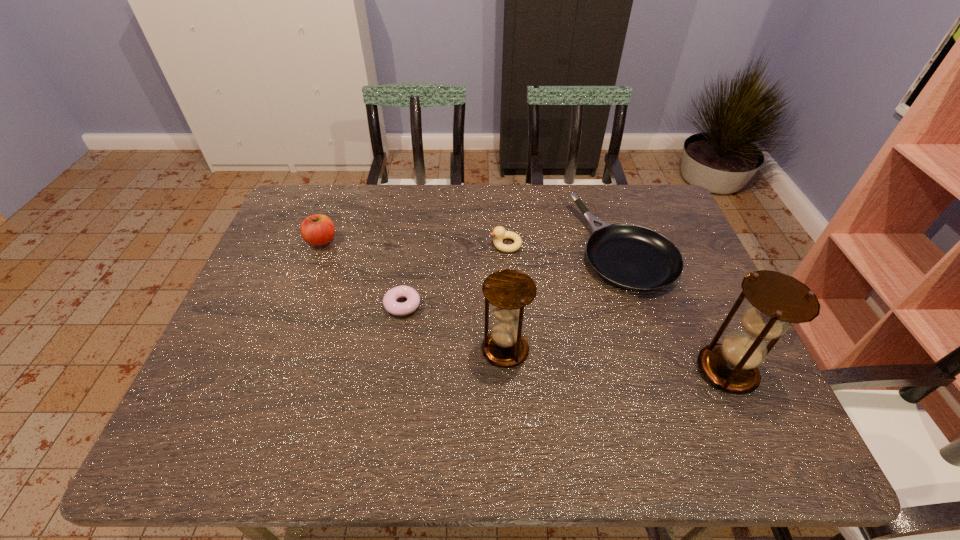
At what (x,y) coordinates should I click in order to perform the action: click on object that is at the left edge. Please return your answer as a coordinate pair (x, y). This screenshot has width=960, height=540. Looking at the image, I should click on (317, 230).

This screenshot has height=540, width=960. What are the coordinates of `hourglass that is at the right edge` in the screenshot? It's located at (777, 300).

The height and width of the screenshot is (540, 960). I want to click on pan located in the right edge section of the desktop, so click(x=633, y=257).

Find the location of a particular element. The height and width of the screenshot is (540, 960). object present at the far right corner is located at coordinates click(x=633, y=257).

Image resolution: width=960 pixels, height=540 pixels. I want to click on object located at the near right corner, so click(777, 300).

Where is `vacant space at the far edge of the desktop`? The width and height of the screenshot is (960, 540). vacant space at the far edge of the desktop is located at coordinates (599, 194).

Identify the location of vacant space at the near edge of the desktop. (400, 391).

Locate an element on the screen. This screenshot has height=540, width=960. free space at the left edge is located at coordinates (305, 255).

The width and height of the screenshot is (960, 540). In the image, there is a desktop. In order to click on vacant space at the right edge in this screenshot , I will do `click(685, 252)`.

The height and width of the screenshot is (540, 960). I want to click on free space at the far left corner of the desktop, so click(x=324, y=210).